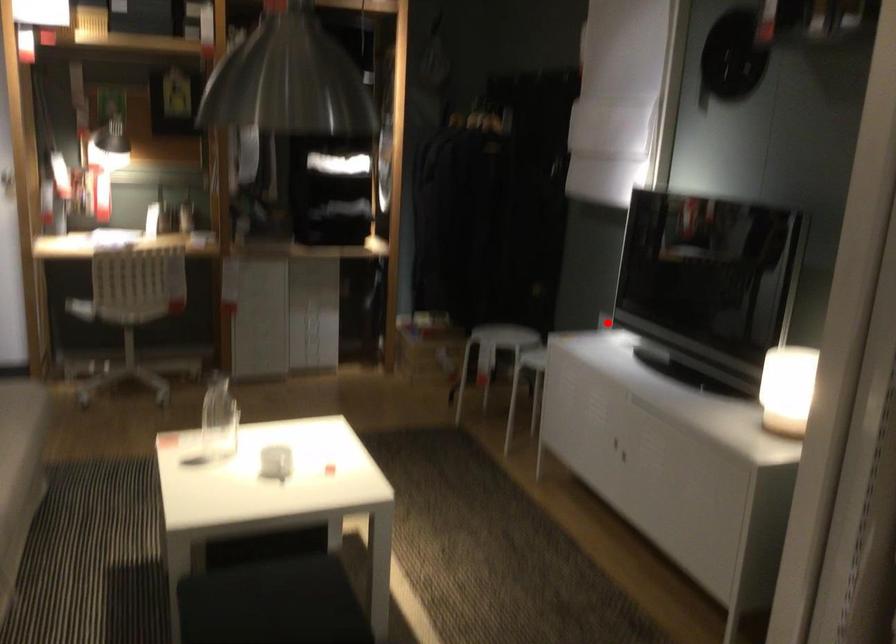
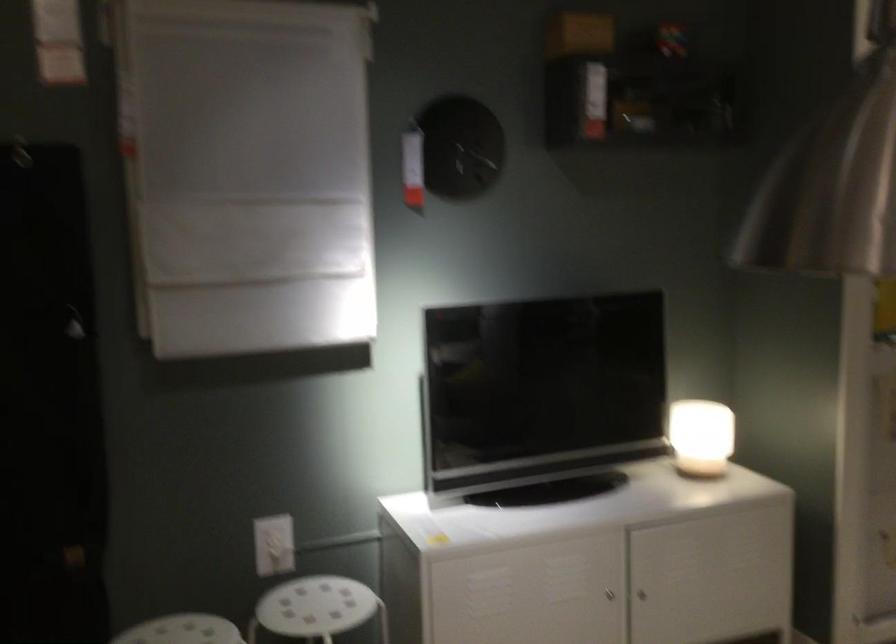
Where in the second image is the point corresponding to the highlighted location from the first image?

(273, 545)